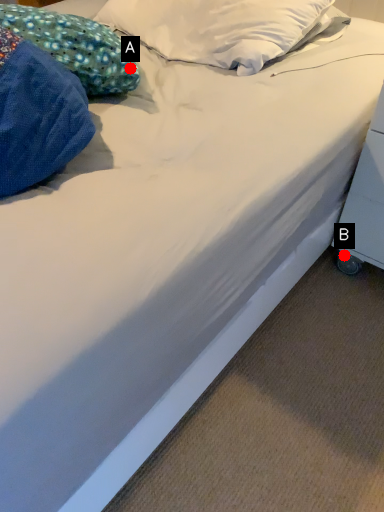
Question: Two points are circled on the image, labeled by A and B beside each circle. Which of the following is the closest to the observer?

Choices:
 (A) A is closer
 (B) B is closer

Answer: (A)